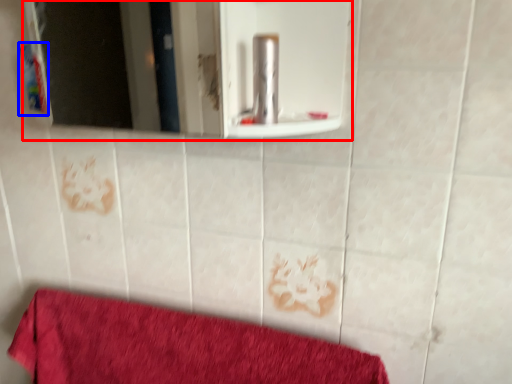
Question: Which point is closer to the camera, mirror (highlighted by a red box) or toiletry (highlighted by a blue box)?

Choices:
 (A) mirror
 (B) toiletry

Answer: (A)